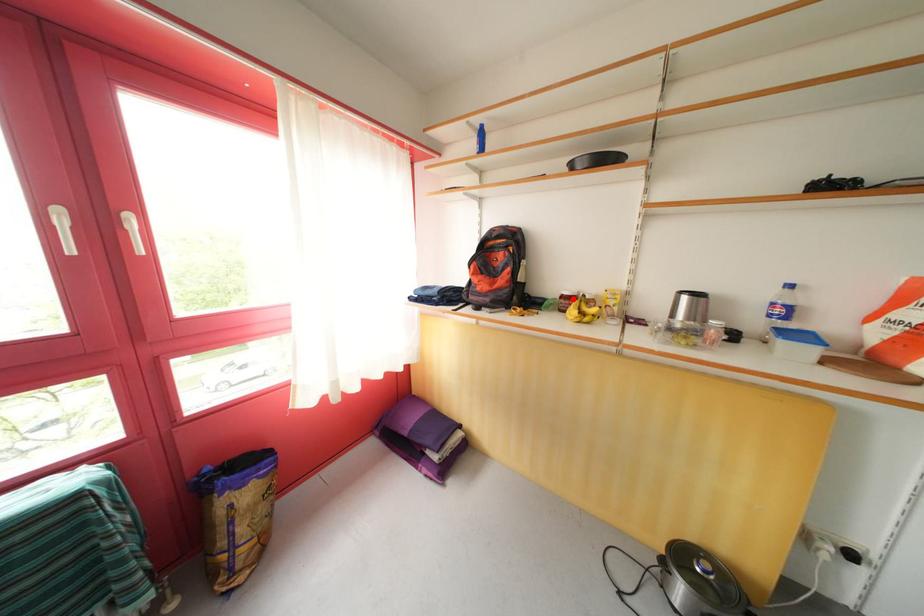
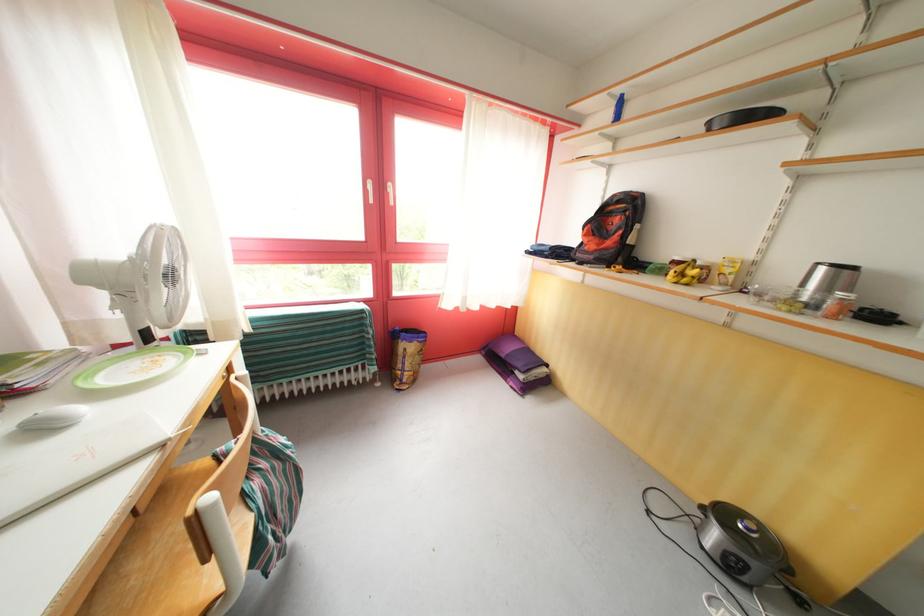
Locate, in the second image, the point that corresponds to the highlighted location in the first image.

(684, 264)